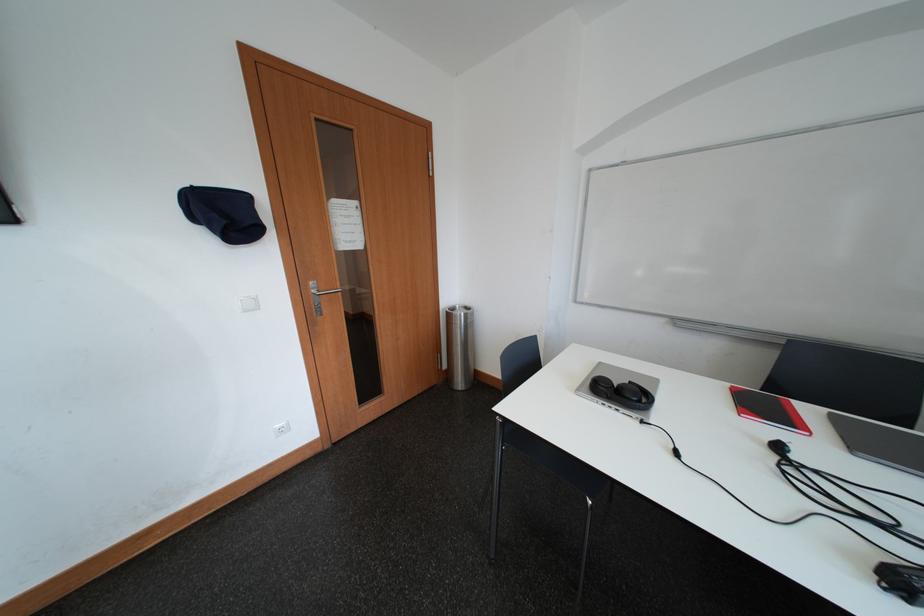
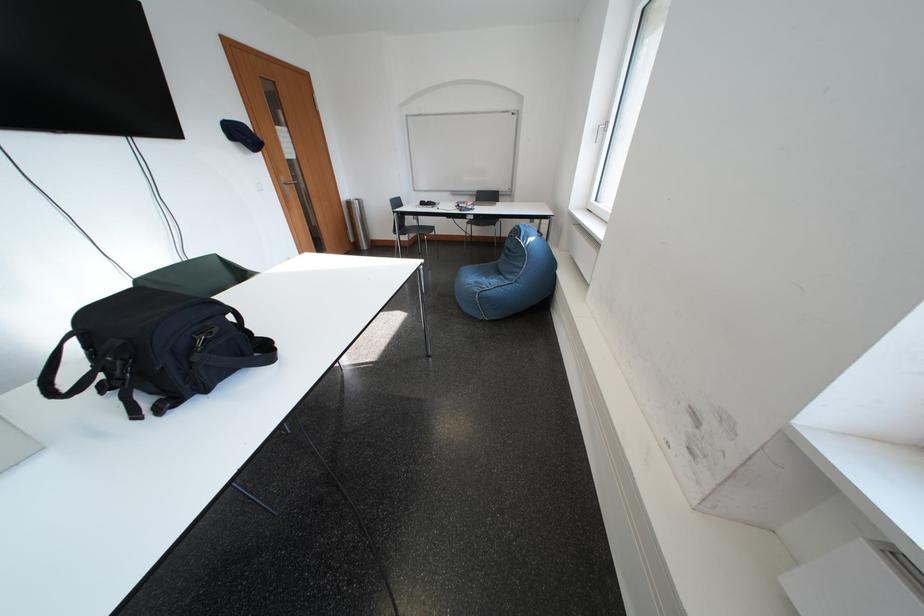
The point at (x=459, y=318) is marked in the first image. Where is the corresponding point in the second image?

(360, 207)